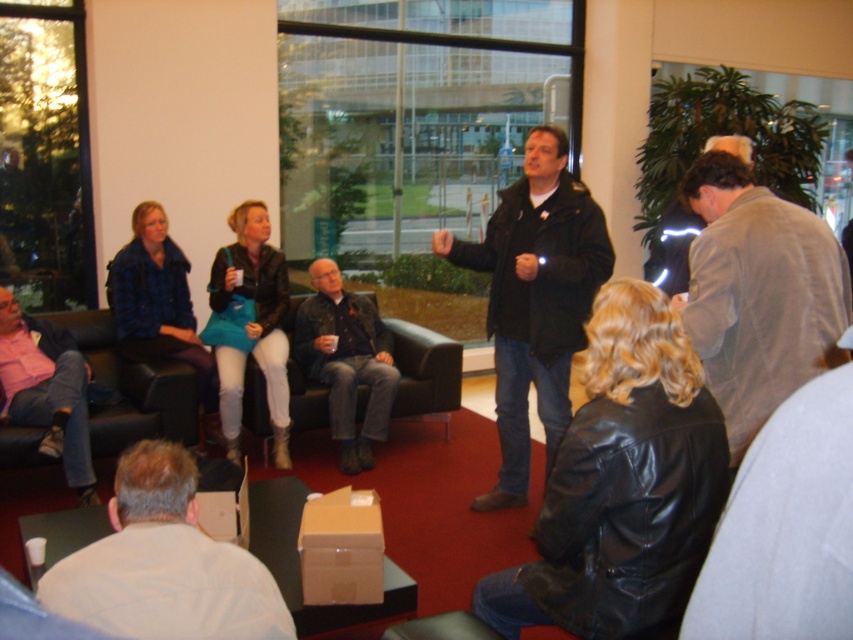
You are a photographer trying to capture a photo of the speaker wearing the black leather jacket at center without including the light gray fabric jacket at upper right in the frame. Is this possible based on their positions?

The black leather jacket at center is positioned under the light gray fabric jacket at upper right, so if you angle your camera to focus on the lower area where the black leather jacket at center is located, you can exclude the light gray fabric jacket at upper right which is above it.

You are organizing a photo shoot and need to know which clothing item is smaller between the white shirt at lower left and the light gray fabric jacket at upper right. Based on the scene description, can you determine which is smaller?

The white shirt at lower left is smaller than the light gray fabric jacket at upper right according to the description.